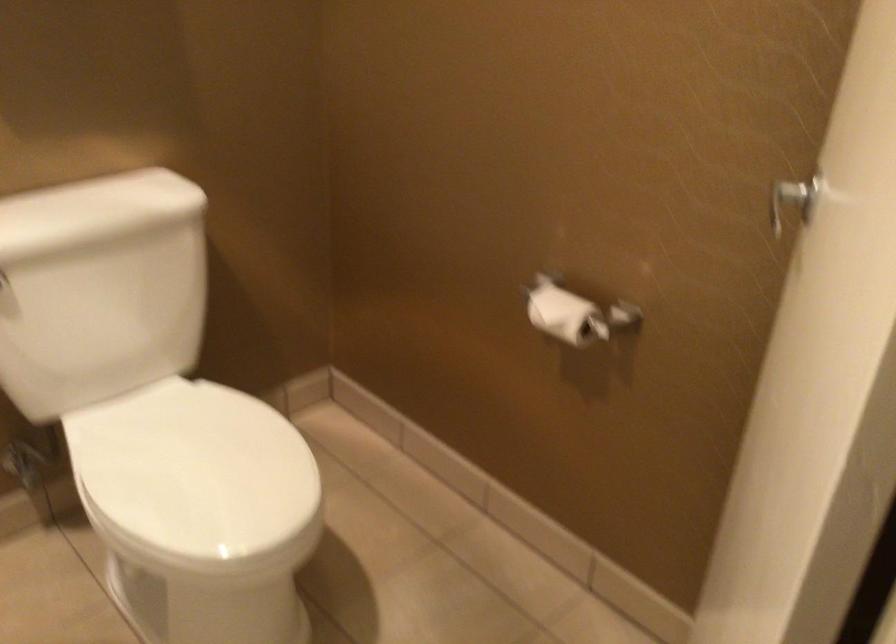
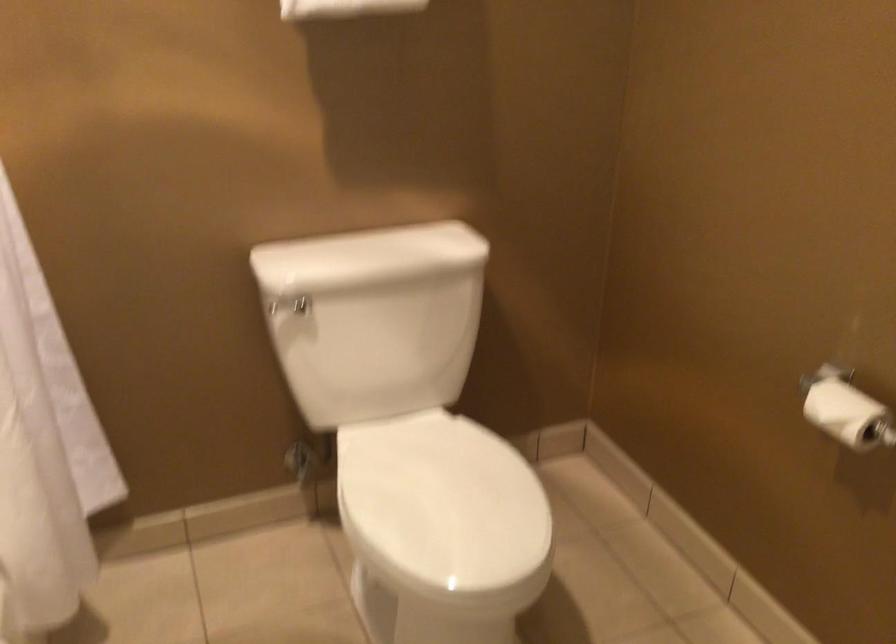
Question: The camera is either moving clockwise (left) or counter-clockwise (right) around the object. The first image is from the beginning of the video and the second image is from the end. Is the camera moving left or right when shooting the video?

Choices:
 (A) Left
 (B) Right

Answer: (B)